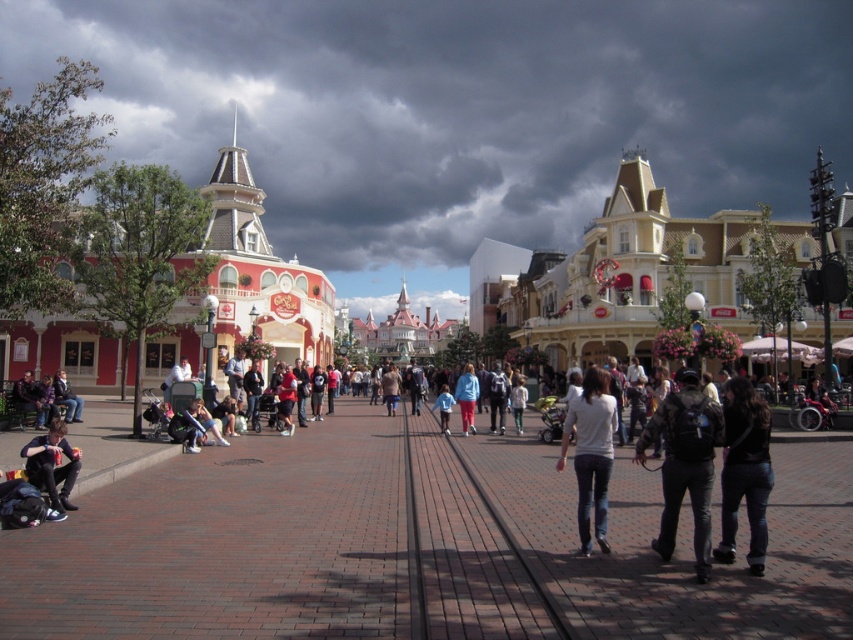
Which is below, light blue fabric jacket at center or white matte jacket at center?

Positioned lower is light blue fabric jacket at center.

Does light blue fabric jacket at center appear on the left side of white matte jacket at center?

Indeed, light blue fabric jacket at center is positioned on the left side of white matte jacket at center.

Is point (466, 364) more distant than point (521, 396)?

Yes, it is behind point (521, 396).

Where is `light blue fabric jacket at center`? This screenshot has width=853, height=640. light blue fabric jacket at center is located at coordinates (467, 397).

Is black leather jacket at center positioned in front of light blue fabric jacket at center?

Yes, black leather jacket at center is closer to the viewer.

Is black leather jacket at center shorter than light blue fabric jacket at center?

In fact, black leather jacket at center may be taller than light blue fabric jacket at center.

Describe the element at coordinates (744, 472) in the screenshot. I see `black leather jacket at center` at that location.

The width and height of the screenshot is (853, 640). What are the coordinates of `black leather jacket at center` in the screenshot? It's located at (744, 472).

Can you confirm if black leather jacket at center is wider than matte black jacket at lower left?

No.

Between point (735, 397) and point (39, 481), which one is positioned behind?

The point (39, 481) is behind.

This screenshot has width=853, height=640. What are the coordinates of `black leather jacket at center` in the screenshot? It's located at (744, 472).